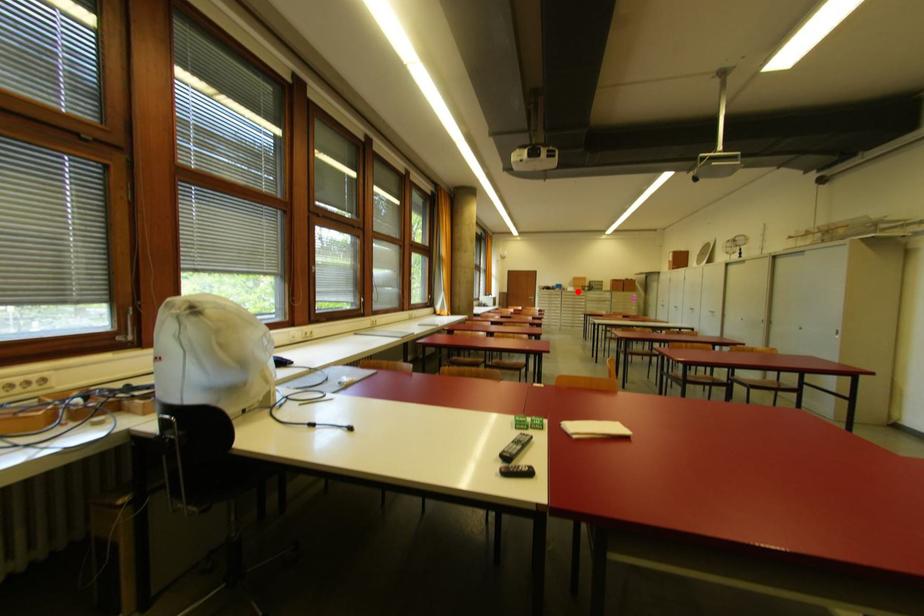
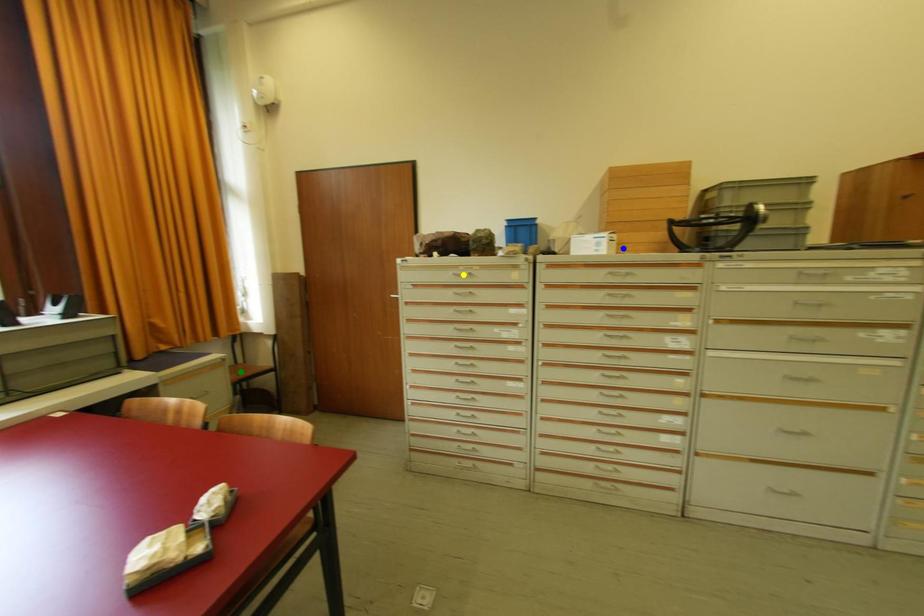
Question: I am providing you with two images of the same scene from different viewpoints. A red point is marked on the first image. You are given multiple points on the second image. Which spot in image 2 lines up with the point in image 1?

Choices:
 (A) yellow point
 (B) blue point
 (C) green point

Answer: (B)